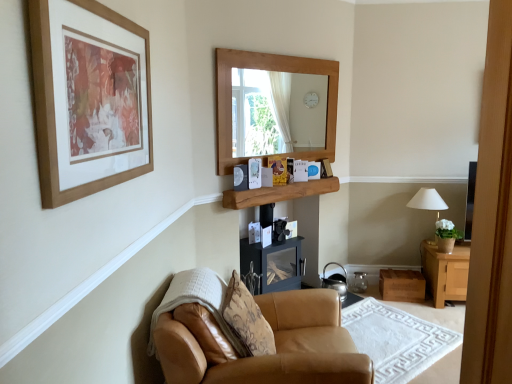
Question: From a real-world perspective, is wooden shelf at center physically below tan leather armchair at lower center?

Choices:
 (A) no
 (B) yes

Answer: (A)

Question: Is wooden shelf at center touching tan leather armchair at lower center?

Choices:
 (A) no
 (B) yes

Answer: (A)

Question: Is wooden shelf at center bigger than tan leather armchair at lower center?

Choices:
 (A) no
 (B) yes

Answer: (A)

Question: Is wooden shelf at center facing away from tan leather armchair at lower center?

Choices:
 (A) yes
 (B) no

Answer: (B)

Question: Is wooden shelf at center aimed at tan leather armchair at lower center?

Choices:
 (A) no
 (B) yes

Answer: (A)

Question: Is wooden shelf at center closer to camera compared to tan leather armchair at lower center?

Choices:
 (A) yes
 (B) no

Answer: (B)

Question: Could you tell me if white fabric lampshade at right is turned towards leather armchair at lower left?

Choices:
 (A) yes
 (B) no

Answer: (B)

Question: Considering the relative positions of white fabric lampshade at right and leather armchair at lower left in the image provided, is white fabric lampshade at right in front of leather armchair at lower left?

Choices:
 (A) yes
 (B) no

Answer: (B)

Question: Does white fabric lampshade at right have a lesser width compared to leather armchair at lower left?

Choices:
 (A) yes
 (B) no

Answer: (A)

Question: From a real-world perspective, is white fabric lampshade at right under leather armchair at lower left?

Choices:
 (A) no
 (B) yes

Answer: (A)

Question: From the image's perspective, is white fabric lampshade at right beneath leather armchair at lower left?

Choices:
 (A) yes
 (B) no

Answer: (B)

Question: Is white fabric lampshade at right behind leather armchair at lower left?

Choices:
 (A) no
 (B) yes

Answer: (B)

Question: Is tan leather armchair at lower center shorter than shiny metallic kettle at lower center?

Choices:
 (A) yes
 (B) no

Answer: (A)